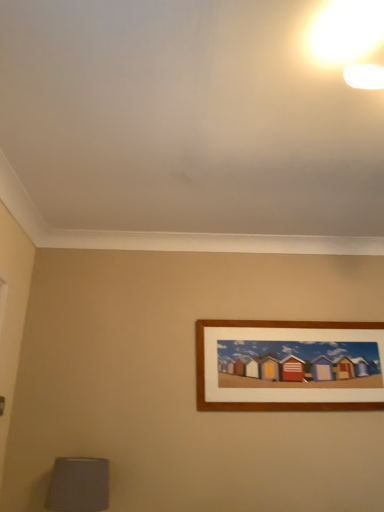
Where is `matte gray lampshade at lower left`? matte gray lampshade at lower left is located at coordinates (78, 485).

In order to face matte gray lampshade at lower left, should I rotate leftwards or rightwards?

Turn left approximately 14.985 degrees to face it.

This screenshot has height=512, width=384. What do you see at coordinates (78, 485) in the screenshot? I see `matte gray lampshade at lower left` at bounding box center [78, 485].

I want to click on matte gray lampshade at lower left, so click(x=78, y=485).